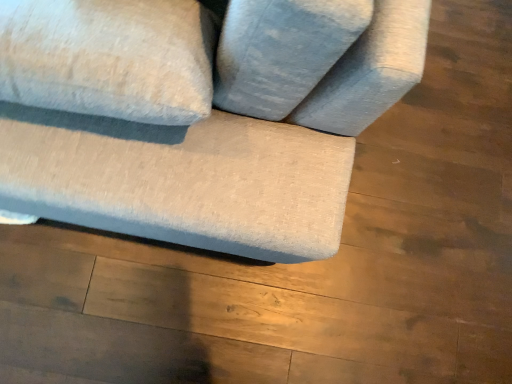
The width and height of the screenshot is (512, 384). What do you see at coordinates (231, 136) in the screenshot? I see `textured fabric couch at lower right` at bounding box center [231, 136].

The image size is (512, 384). Find the location of `textured fabric couch at lower right`. textured fabric couch at lower right is located at coordinates (231, 136).

The height and width of the screenshot is (384, 512). I want to click on textured fabric couch at lower right, so [x=231, y=136].